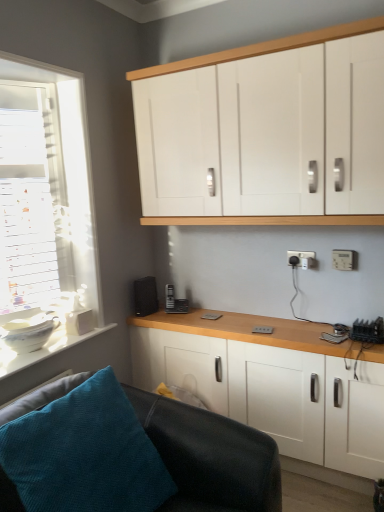
You are a GUI agent. You are given a task and a screenshot of the screen. Output one action in this format:
    pyautogui.click(x=<x>, y=<y>)
    Task: Click on the vacant region in front of black matte speaker at lower left
    
    Given the screenshot: What is the action you would take?
    point(160,319)